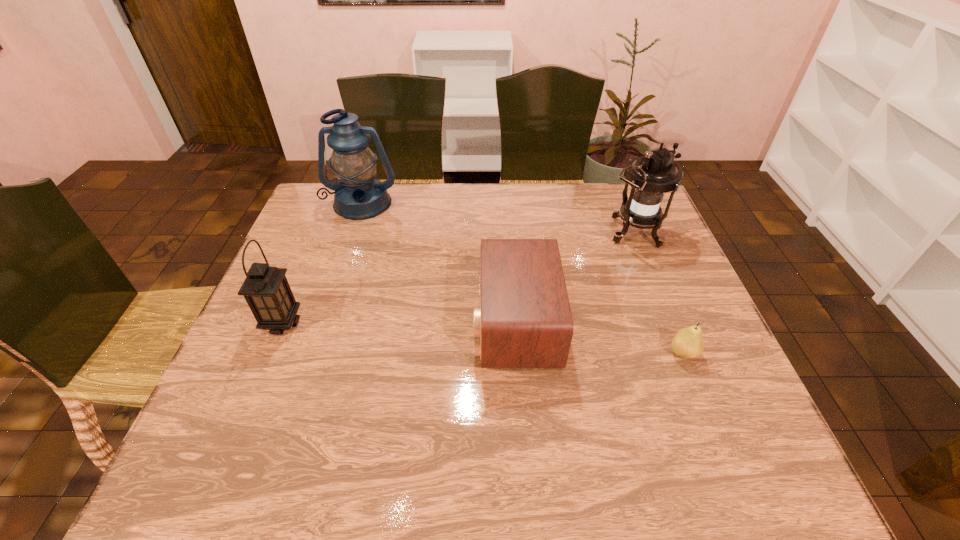
Locate an element on the screen. vacant region located on the front panel of the radio receiver is located at coordinates (396, 323).

Where is `vacant space located 0.280m on the back of the shortest object`? The height and width of the screenshot is (540, 960). vacant space located 0.280m on the back of the shortest object is located at coordinates (646, 262).

Find the location of a particular element. The width and height of the screenshot is (960, 540). lantern at the right edge is located at coordinates (651, 176).

Locate an element on the screen. The image size is (960, 540). pear located at the right edge is located at coordinates (687, 343).

Find the location of a particular element. The width and height of the screenshot is (960, 540). object at the far left corner is located at coordinates (358, 196).

Identify the location of object at the far right corner. (651, 176).

Locate an element on the screen. Image resolution: width=960 pixels, height=540 pixels. free location at the far edge is located at coordinates (450, 184).

Find the location of `free region at the near edge of the desktop`. free region at the near edge of the desktop is located at coordinates (447, 441).

The image size is (960, 540). In the image, there is a desktop. What are the coordinates of `free region at the left edge` in the screenshot? It's located at (247, 427).

The image size is (960, 540). What are the coordinates of `vacant space at the right edge` in the screenshot? It's located at (671, 349).